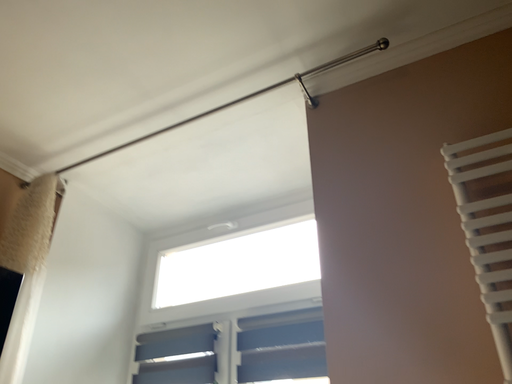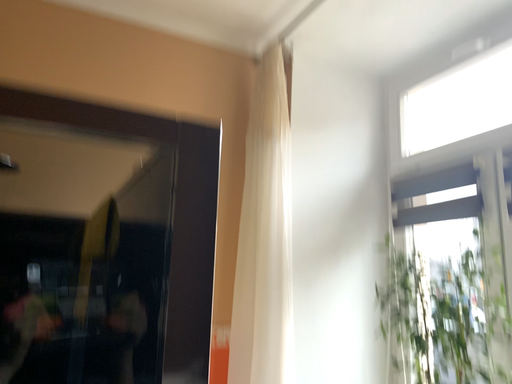
Question: Which way did the camera rotate in the video?

Choices:
 (A) rotated downward
 (B) rotated upward

Answer: (A)